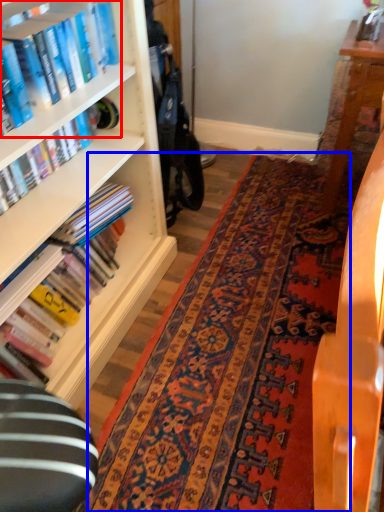
Question: Among these objects, which one is nearest to the camera, book (highlighted by a red box) or mat (highlighted by a blue box)?

Choices:
 (A) book
 (B) mat

Answer: (A)